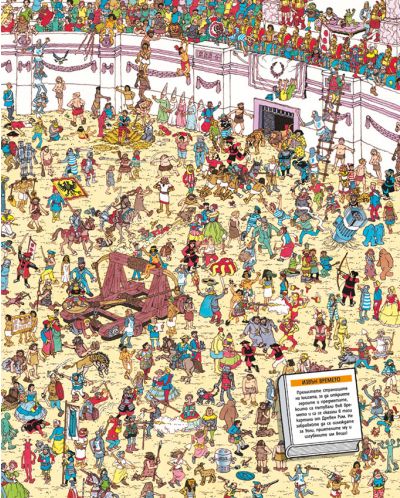
Find the location of a particular element. The width and height of the screenshot is (400, 498). rungs on ladder is located at coordinates (323, 172), (327, 161), (329, 148), (325, 140), (334, 130), (327, 121), (336, 112), (339, 103), (340, 93).